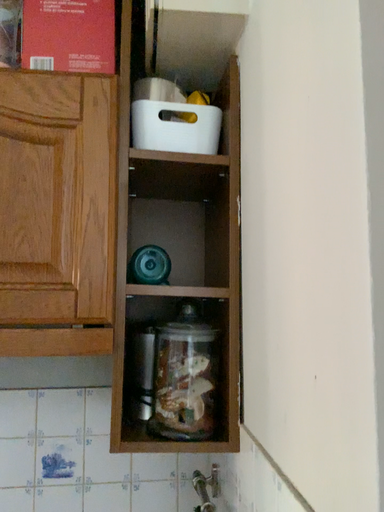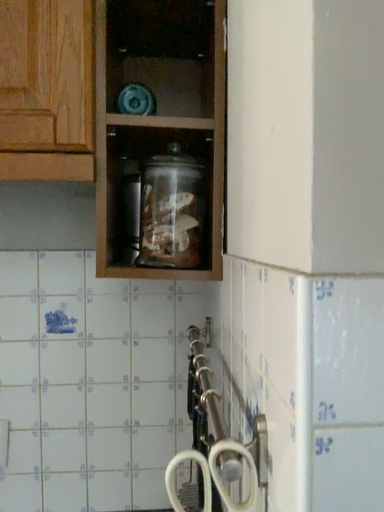
Question: How did the camera likely rotate when shooting the video?

Choices:
 (A) rotated downward
 (B) rotated upward

Answer: (A)